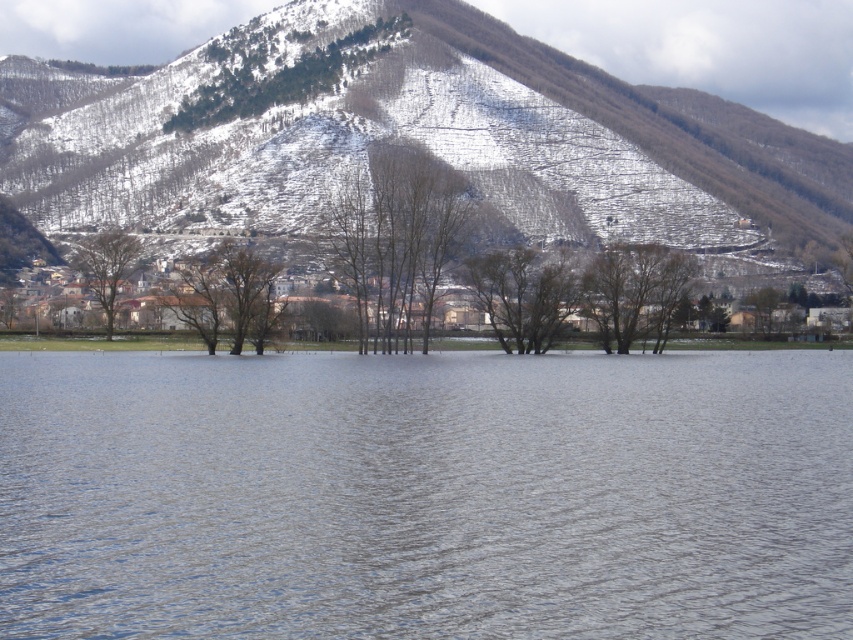
Does clear water at center have a greater width compared to brown matte tree at center?

Incorrect, clear water at center's width does not surpass brown matte tree at center's.

Between point (281, 408) and point (115, 259), which one is positioned behind?

The point (115, 259) is behind.

Where is `clear water at center`? This screenshot has height=640, width=853. clear water at center is located at coordinates (425, 496).

Measure the distance between point (125, 449) and camera.

Point (125, 449) and camera are 190.33 feet apart from each other.

Does clear water at center have a greater height compared to bare branches at center?

No.

Is point (508, 472) positioned before point (357, 221)?

Yes, it is in front of point (357, 221).

You are a GUI agent. You are given a task and a screenshot of the screen. Output one action in this format:
    pyautogui.click(x=<x>, y=<y>)
    Task: Click on the clear water at center
    
    Given the screenshot: What is the action you would take?
    pyautogui.click(x=425, y=496)

Who is more distant from viewer, (392, 188) or (90, 244)?

The point (90, 244) is more distant.

What do you see at coordinates (395, 237) in the screenshot?
I see `bare branches at center` at bounding box center [395, 237].

This screenshot has width=853, height=640. I want to click on bare branches at center, so click(x=395, y=237).